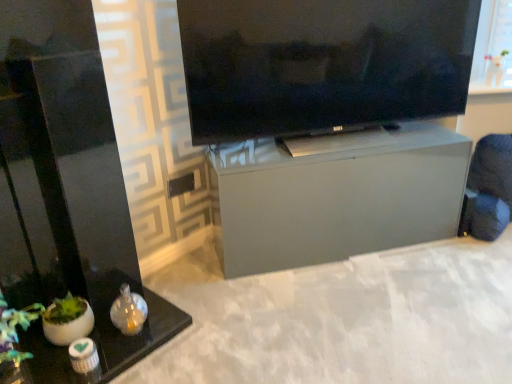
Identify the location of free spot in front of satin gray cabinet at center, the second furniture from the front. The image size is (512, 384). (342, 315).